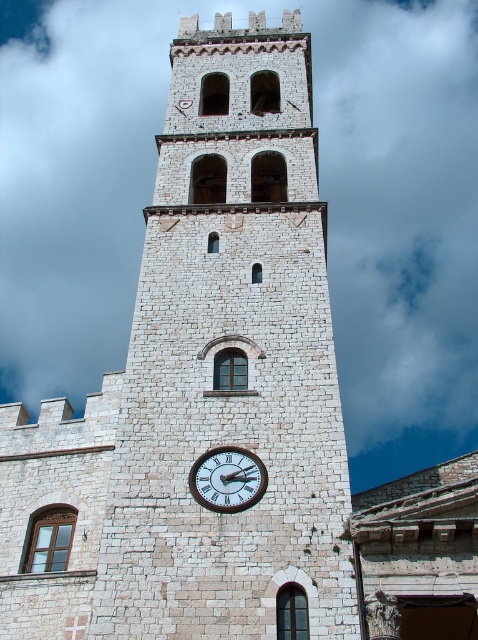
Question: From the image, what is the correct spatial relationship of white stone clock tower at center in relation to white wooden clock at center?

Choices:
 (A) left
 (B) right

Answer: (B)

Question: Which object is farther from the camera taking this photo?

Choices:
 (A) white stone clock tower at center
 (B) white wooden clock at center

Answer: (B)

Question: Does white stone clock tower at center appear over white wooden clock at center?

Choices:
 (A) yes
 (B) no

Answer: (A)

Question: Does white stone clock tower at center appear over white wooden clock at center?

Choices:
 (A) yes
 (B) no

Answer: (A)